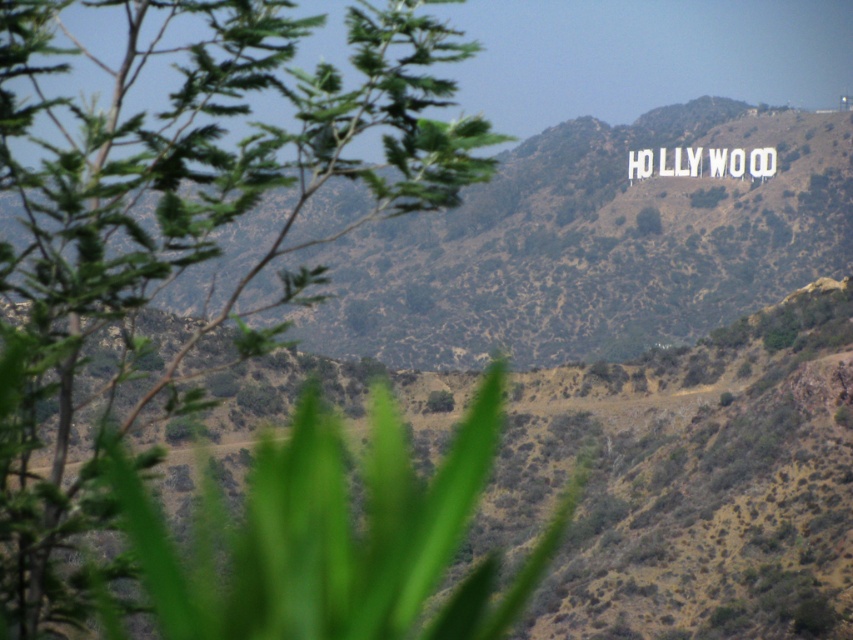
Does green leafy tree at left appear on the right side of green grassy hillside at upper center?

Incorrect, green leafy tree at left is not on the right side of green grassy hillside at upper center.

Which of these two, green leafy tree at left or green grassy hillside at upper center, stands taller?

With more height is green leafy tree at left.

Who is more forward, (250,92) or (799,186)?

Point (250,92) is more forward.

You are a GUI agent. You are given a task and a screenshot of the screen. Output one action in this format:
    pyautogui.click(x=<x>, y=<y>)
    Task: Click on the green leafy tree at left
    
    Given the screenshot: What is the action you would take?
    pyautogui.click(x=177, y=224)